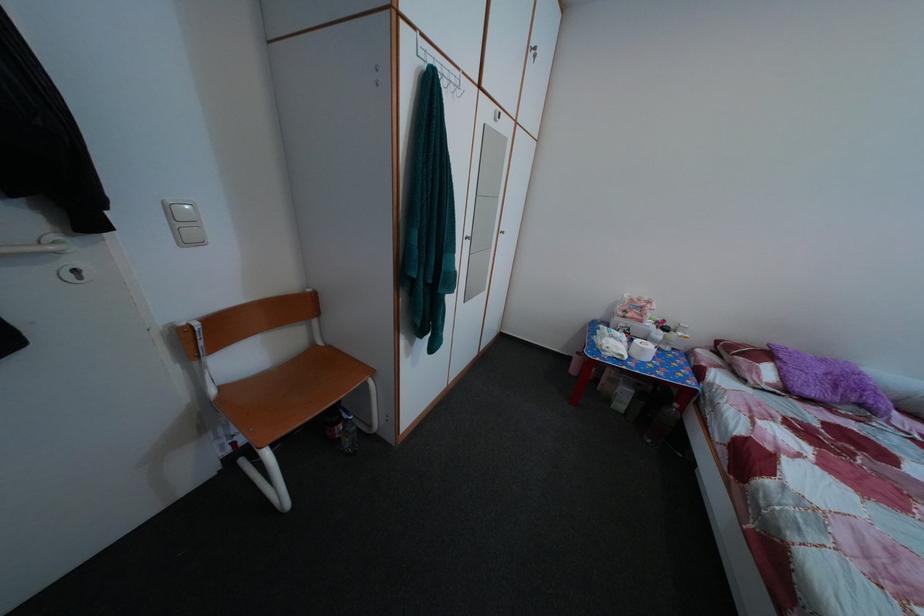
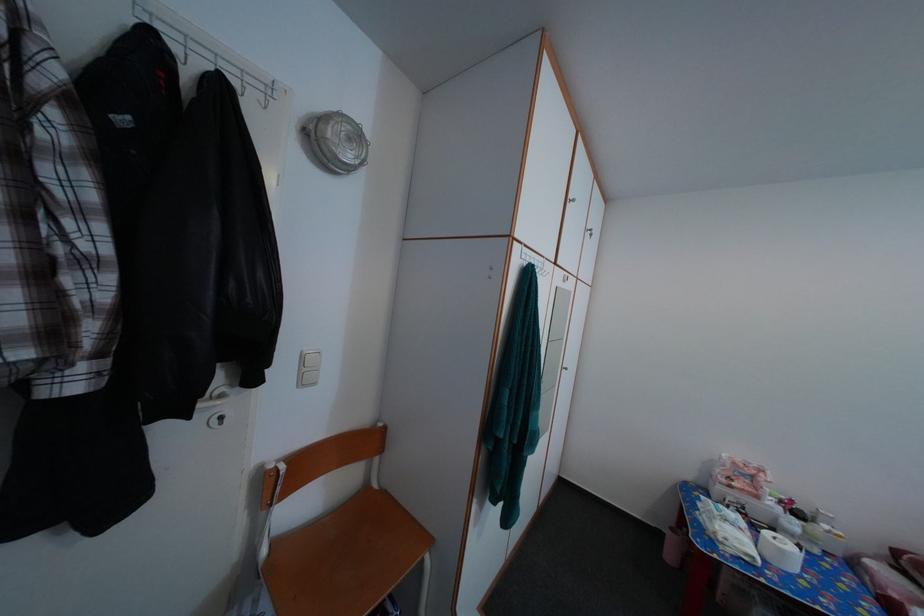
Find the pixel in the second image that matches [229,395] in the first image.

(282, 552)